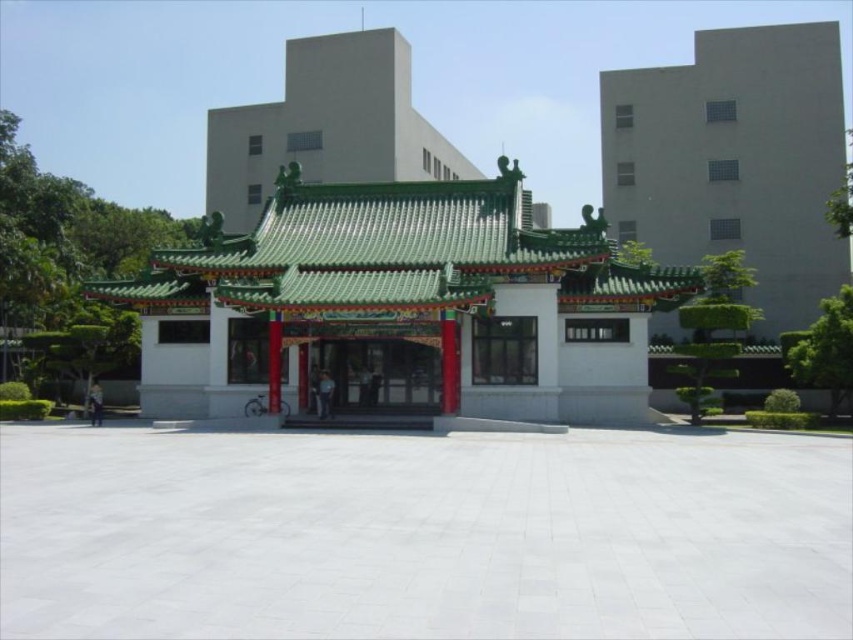
Question: Which of the following is the farthest from the observer?

Choices:
 (A) green tile roof gazebo at center
 (B) smooth concrete building at upper right
 (C) matte red door at center

Answer: (B)

Question: Observing the image, what is the correct spatial positioning of smooth concrete building at upper right in reference to matte red door at center?

Choices:
 (A) above
 (B) below

Answer: (A)

Question: Does green tile roof gazebo at center have a greater width compared to matte red door at center?

Choices:
 (A) yes
 (B) no

Answer: (A)

Question: Which point appears closest to the camera in this image?

Choices:
 (A) (514, 401)
 (B) (389, 362)

Answer: (A)

Question: Is the position of green tile roof gazebo at center less distant than that of smooth concrete building at upper right?

Choices:
 (A) no
 (B) yes

Answer: (B)

Question: Based on their relative distances, which object is nearer to the smooth concrete building at upper right?

Choices:
 (A) green tile roof gazebo at center
 (B) matte red door at center

Answer: (A)